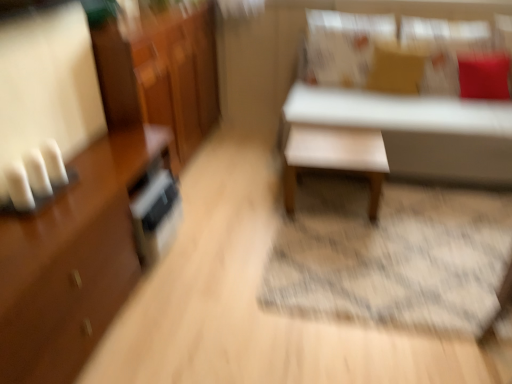
This screenshot has width=512, height=384. What do you see at coordinates (101, 197) in the screenshot? I see `brown glossy cabinet at left` at bounding box center [101, 197].

In the scene shown: How much space does red velvet cushion at upper right, which is counted as the third pillow, starting from the left, occupy horizontally?

The width of red velvet cushion at upper right, which is counted as the third pillow, starting from the left, is 10.96 inches.

Locate an element on the screen. Image resolution: width=512 pixels, height=384 pixels. red velvet cushion at upper right, the first pillow when ordered from right to left is located at coordinates [484, 76].

In order to face matte brown pillow at upper center, the second pillow from the right, should I rotate leftwards or rightwards?

To align with it, rotate right about 18.330°.

The height and width of the screenshot is (384, 512). In order to click on matte brown pillow at upper center, the second pillow from the right in this screenshot , I will do `click(396, 68)`.

What is the approximate height of white matte bench at upper right, acting as the first table starting from the right?

35.76 inches.

The image size is (512, 384). In order to click on brown glossy cabinet at left in this screenshot , I will do `click(101, 197)`.

Does matte brown pillow at upper center, the second pillow from the right, appear on the right side of red velvet cushion at upper right, the first pillow when ordered from right to left?

No.

Based on the photo, from the image's perspective, is matte brown pillow at upper center, the second pillow from the right, positioned above or below red velvet cushion at upper right, the first pillow when ordered from right to left?

matte brown pillow at upper center, the second pillow from the right, is above red velvet cushion at upper right, the first pillow when ordered from right to left.

Is matte brown pillow at upper center, the second pillow from the right, oriented away from red velvet cushion at upper right, the first pillow when ordered from right to left?

That's not correct — matte brown pillow at upper center, the second pillow from the right, is not looking away from red velvet cushion at upper right, the first pillow when ordered from right to left.

Is brown glossy cabinet at left shorter than smooth beige table at center, the second table positioned from the right?

No.

Who is bigger, brown glossy cabinet at left or smooth beige table at center, the second table positioned from the right?

brown glossy cabinet at left.

At what (x,y) coordinates should I click in order to perform the action: click on cabinetry below the smooth beige table at center, the second table positioned from the right (from the image's perspective). Please return your answer as a coordinate pair (x, y). Looking at the image, I should click on (101, 197).

Between point (116, 38) and point (304, 167), which one is positioned in front?

The point (116, 38) is closer.

From a real-world perspective, is shiny brown dresser at left located higher than smooth beige table at center, which is the 1th table in left-to-right order?

Yes, from a real-world perspective, shiny brown dresser at left is above smooth beige table at center, which is the 1th table in left-to-right order.

Who is taller, shiny brown dresser at left or smooth beige table at center, which is the 1th table in left-to-right order?

shiny brown dresser at left is taller.

From the image's perspective, between shiny brown dresser at left and smooth beige table at center, which is the 1th table in left-to-right order, which one is located above?

shiny brown dresser at left, from the image's perspective.

Is matte brown pillow at upper center, the second pillow viewed from the left, turned away from shiny brown dresser at left?

No.

Can we say matte brown pillow at upper center, the second pillow viewed from the left, lies outside shiny brown dresser at left?

Yes, matte brown pillow at upper center, the second pillow viewed from the left, is outside of shiny brown dresser at left.

Is point (409, 88) positioned in front of point (207, 131)?

Yes, it is in front of point (207, 131).

Relative to shiny brown dresser at left, is matte brown pillow at upper center, the second pillow from the right, in front or behind?

In the image, matte brown pillow at upper center, the second pillow from the right, appears behind shiny brown dresser at left.

Which object is wider, white fabric pillow at upper right, the first pillow viewed from the left, or shiny brown dresser at left?

shiny brown dresser at left.

Which of these two, white fabric pillow at upper right, which ranks as the 3th pillow in right-to-left order, or shiny brown dresser at left, stands taller?

shiny brown dresser at left.

Which of these two, white fabric pillow at upper right, which ranks as the 3th pillow in right-to-left order, or shiny brown dresser at left, is bigger?

shiny brown dresser at left is bigger.

Based on the photo, can you see white fabric pillow at upper right, which ranks as the 3th pillow in right-to-left order, touching shiny brown dresser at left?

They are not placed beside each other.

Considering the points (106, 150) and (503, 177), which point is in front, point (106, 150) or point (503, 177)?

The point (106, 150) is closer to the camera.

Which is correct: brown glossy cabinet at left is inside white matte bench at upper right, arranged as the 2th table when viewed from the left, or outside of it?

brown glossy cabinet at left is not inside white matte bench at upper right, arranged as the 2th table when viewed from the left, it's outside.

Is brown glossy cabinet at left looking in the opposite direction of white matte bench at upper right, arranged as the 2th table when viewed from the left?

No, brown glossy cabinet at left is not facing away from white matte bench at upper right, arranged as the 2th table when viewed from the left.

From the image's perspective, does brown glossy cabinet at left appear higher than white matte bench at upper right, arranged as the 2th table when viewed from the left?

Actually, brown glossy cabinet at left appears below white matte bench at upper right, arranged as the 2th table when viewed from the left, in the image.

Between white matte bench at upper right, acting as the first table starting from the right, and white fabric pillow at upper right, which ranks as the 3th pillow in right-to-left order, which one appears on the right side from the viewer's perspective?

Positioned to the right is white matte bench at upper right, acting as the first table starting from the right.

Would you say white matte bench at upper right, arranged as the 2th table when viewed from the left, is inside or outside white fabric pillow at upper right, which ranks as the 3th pillow in right-to-left order?

white matte bench at upper right, arranged as the 2th table when viewed from the left, is not enclosed by white fabric pillow at upper right, which ranks as the 3th pillow in right-to-left order.

How much distance is there between white matte bench at upper right, arranged as the 2th table when viewed from the left, and white fabric pillow at upper right, the first pillow viewed from the left?

The distance of white matte bench at upper right, arranged as the 2th table when viewed from the left, from white fabric pillow at upper right, the first pillow viewed from the left, is 59.61 centimeters.

Can you confirm if white matte bench at upper right, acting as the first table starting from the right, is shorter than white fabric pillow at upper right, the first pillow viewed from the left?

No.

Which pillow is the 1st one when counting from the back of the red velvet cushion at upper right, which is counted as the third pillow, starting from the left? Please provide its 2D coordinates.

[(396, 68)]

Find the location of a particular element. Image resolution: width=512 pixels, height=384 pixels. cabinetry located below the smooth beige table at center, the second table positioned from the right (from the image's perspective) is located at coordinates (101, 197).

In the scene shown: Estimate the real-world distances between objects in this image. Which object is closer to smooth beige table at center, which is the 1th table in left-to-right order, white matte bench at upper right, arranged as the 2th table when viewed from the left, or brown glossy cabinet at left?

Among the two, white matte bench at upper right, arranged as the 2th table when viewed from the left, is located nearer to smooth beige table at center, which is the 1th table in left-to-right order.

Based on their spatial positions, is white fabric pillow at upper right, which ranks as the 3th pillow in right-to-left order, or matte brown pillow at upper center, the second pillow viewed from the left, further from red velvet cushion at upper right, which is counted as the third pillow, starting from the left?

white fabric pillow at upper right, which ranks as the 3th pillow in right-to-left order, is positioned further to the anchor red velvet cushion at upper right, which is counted as the third pillow, starting from the left.

Estimate the real-world distances between objects in this image. Which object is further from shiny brown dresser at left, matte brown pillow at upper center, the second pillow viewed from the left, or brown glossy cabinet at left?

Among the two, matte brown pillow at upper center, the second pillow viewed from the left, is located further to shiny brown dresser at left.

From the image, which object appears to be nearer to white matte bench at upper right, arranged as the 2th table when viewed from the left, smooth beige table at center, which is the 1th table in left-to-right order, or white fabric pillow at upper right, the first pillow viewed from the left?

Among the two, smooth beige table at center, which is the 1th table in left-to-right order, is located nearer to white matte bench at upper right, arranged as the 2th table when viewed from the left.

When comparing their distances from shiny brown dresser at left, does matte brown pillow at upper center, the second pillow viewed from the left, or smooth beige table at center, which is the 1th table in left-to-right order, seem closer?

Among the two, smooth beige table at center, which is the 1th table in left-to-right order, is located nearer to shiny brown dresser at left.

Based on the photo, considering their positions, is smooth beige table at center, which is the 1th table in left-to-right order, positioned further to shiny brown dresser at left than brown glossy cabinet at left?

smooth beige table at center, which is the 1th table in left-to-right order, lies further to shiny brown dresser at left than the other object.

Estimate the real-world distances between objects in this image. Which object is closer to brown glossy cabinet at left, matte brown pillow at upper center, the second pillow from the right, or white matte bench at upper right, acting as the first table starting from the right?

white matte bench at upper right, acting as the first table starting from the right.

From the image, which object appears to be farther from white fabric pillow at upper right, which ranks as the 3th pillow in right-to-left order, shiny brown dresser at left or white matte bench at upper right, acting as the first table starting from the right?

shiny brown dresser at left.

I want to click on table between matte brown pillow at upper center, the second pillow viewed from the left, and smooth beige table at center, which is the 1th table in left-to-right order, vertically, so click(x=418, y=130).

Locate an element on the screen. table between white fabric pillow at upper right, the first pillow viewed from the left, and red velvet cushion at upper right, which is counted as the third pillow, starting from the left, in the horizontal direction is located at coordinates (418, 130).

This screenshot has width=512, height=384. Find the location of `table situated between shiny brown dresser at left and matte brown pillow at upper center, the second pillow viewed from the left, from left to right`. table situated between shiny brown dresser at left and matte brown pillow at upper center, the second pillow viewed from the left, from left to right is located at coordinates [335, 158].

Locate an element on the screen. This screenshot has width=512, height=384. dresser between brown glossy cabinet at left and white matte bench at upper right, acting as the first table starting from the right is located at coordinates (161, 75).